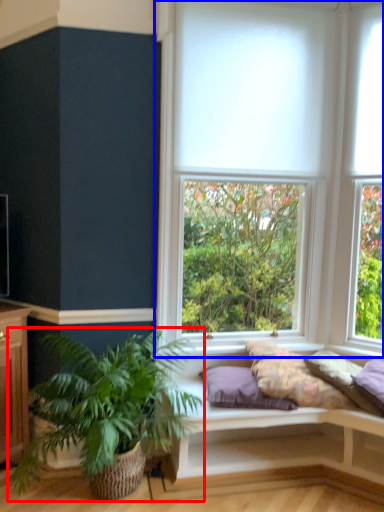
Question: Which object is further to the camera taking this photo, houseplant (highlighted by a red box) or window (highlighted by a blue box)?

Choices:
 (A) houseplant
 (B) window

Answer: (B)